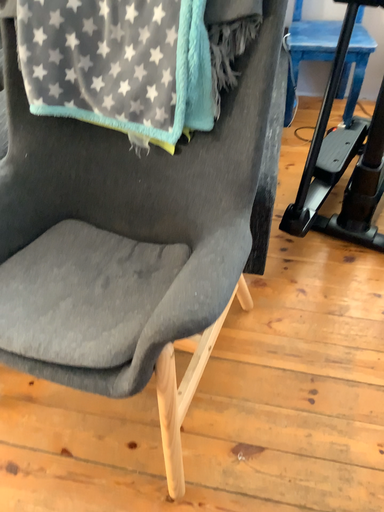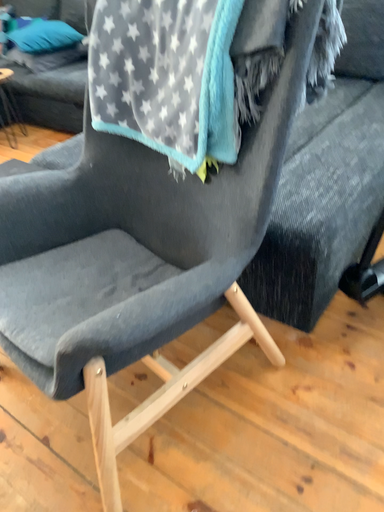
Question: Which way did the camera rotate in the video?

Choices:
 (A) rotated upward
 (B) rotated downward

Answer: (A)